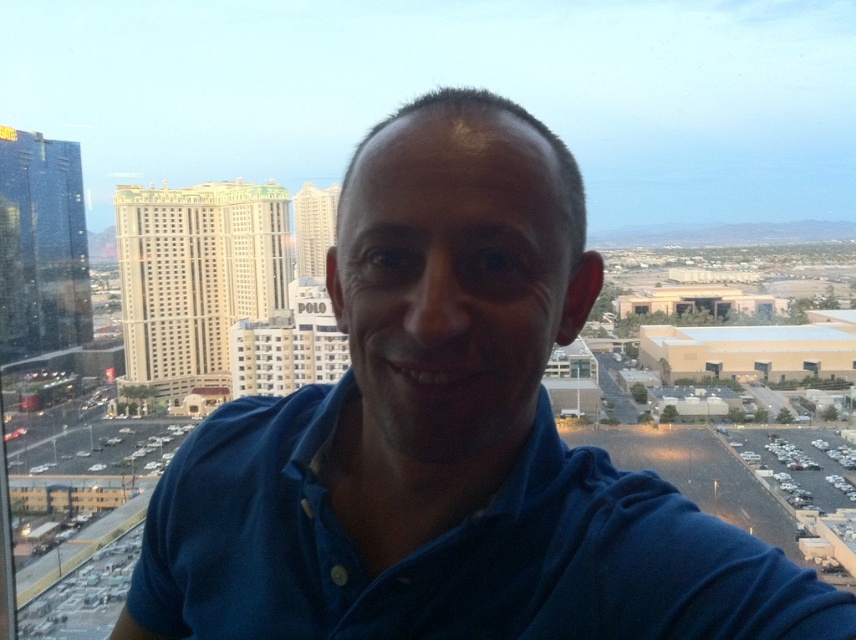
Question: Which object is farther from the camera taking this photo?

Choices:
 (A) blue cotton shirt at center
 (B) blue cotton polo shirt at center

Answer: (B)

Question: Is blue cotton shirt at center smaller than blue cotton polo shirt at center?

Choices:
 (A) no
 (B) yes

Answer: (A)

Question: Observing the image, what is the correct spatial positioning of blue cotton shirt at center in reference to blue cotton polo shirt at center?

Choices:
 (A) right
 (B) left

Answer: (B)

Question: In this image, where is blue cotton shirt at center located relative to blue cotton polo shirt at center?

Choices:
 (A) left
 (B) right

Answer: (A)

Question: Which of the following is the farthest from the observer?

Choices:
 (A) tap(629, 618)
 (B) tap(345, 552)

Answer: (B)